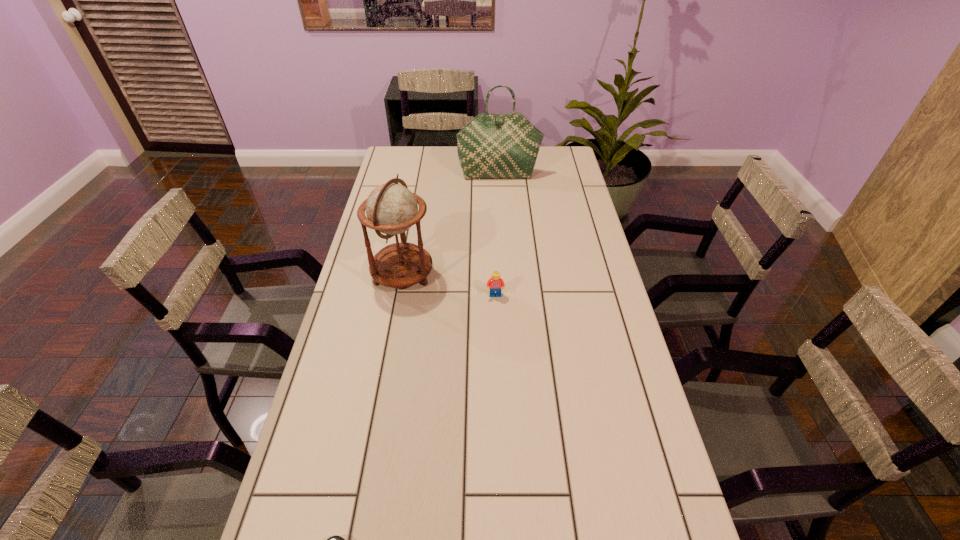
The width and height of the screenshot is (960, 540). In the image, there is a desktop. Identify the location of vacant space at the far edge. (453, 150).

The width and height of the screenshot is (960, 540). Find the location of `vacant region at the left edge of the desktop`. vacant region at the left edge of the desktop is located at coordinates (371, 325).

In the image, there is a desktop. Identify the location of vacant space at the right edge. (594, 264).

Find the location of `free space at the far right corner of the desktop`. free space at the far right corner of the desktop is located at coordinates (570, 165).

At what (x,y) coordinates should I click in order to perform the action: click on vacant region between the farthest object and the third tallest object. Please return your answer as a coordinate pair (x, y). Looking at the image, I should click on (497, 235).

This screenshot has height=540, width=960. In order to click on vacant point located between the Lego and the farthest object in this screenshot , I will do `click(497, 235)`.

The height and width of the screenshot is (540, 960). In order to click on vacant space that's between the farthest object and the Lego in this screenshot , I will do `click(497, 235)`.

Where is `free area in between the globe and the Lego`? This screenshot has height=540, width=960. free area in between the globe and the Lego is located at coordinates (449, 285).

Where is `vacant area that lies between the farthest object and the Lego`? This screenshot has height=540, width=960. vacant area that lies between the farthest object and the Lego is located at coordinates (497, 235).

Find the location of a particular element. Image resolution: width=960 pixels, height=540 pixels. free space between the globe and the tote bag is located at coordinates (451, 225).